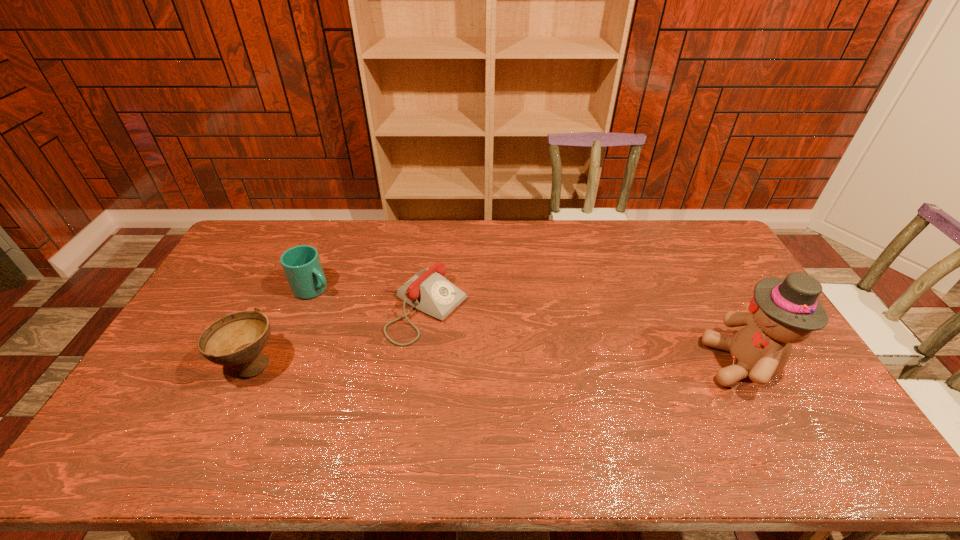
Image resolution: width=960 pixels, height=540 pixels. I want to click on vacant space on the desktop that is between the soup bowl and the tallest object and is positioned on the dial of the third object from left to right, so click(x=523, y=364).

Locate an element on the screen. The image size is (960, 540). free space on the desktop that is between the soup bowl and the tallest object and is positioned on the handle side of the cup is located at coordinates (457, 364).